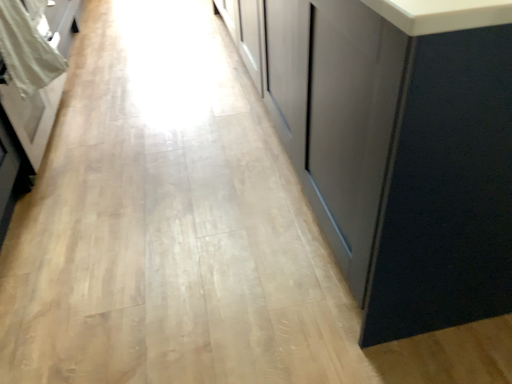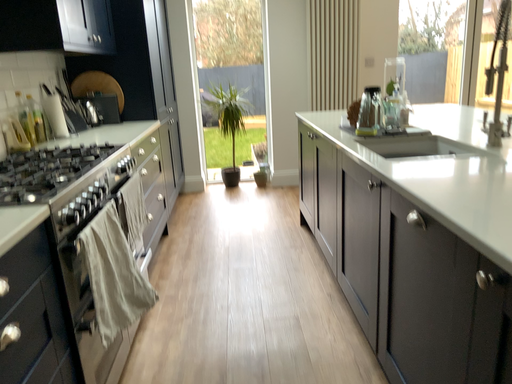
Question: Which way did the camera rotate in the video?

Choices:
 (A) rotated right
 (B) rotated left

Answer: (B)